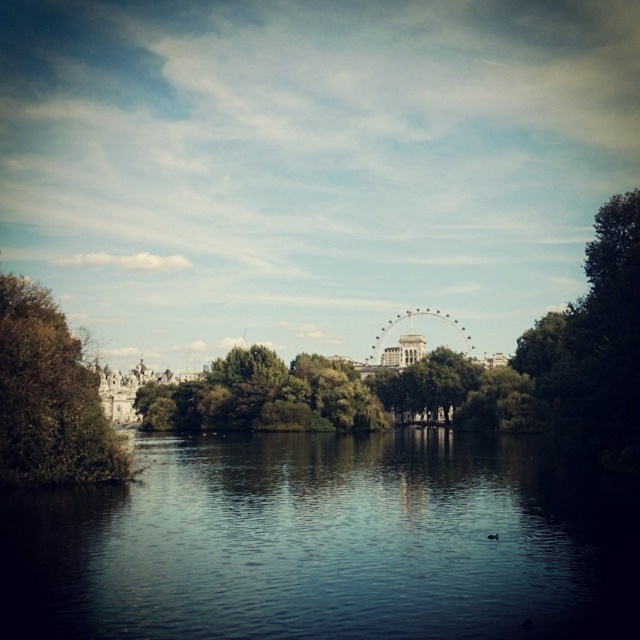
Question: Which point is closer to the camera?

Choices:
 (A) (372, 362)
 (B) (67, 384)
 (C) (353, 404)

Answer: (B)

Question: Which object appears farthest from the camera in this image?

Choices:
 (A) green leafy tree at left
 (B) green leafy tree at right

Answer: (B)

Question: Does green leafy tree at center have a lesser width compared to metallic ferris wheel at center?

Choices:
 (A) yes
 (B) no

Answer: (B)

Question: Does green leafy tree at right have a greater width compared to green leafy tree at left?

Choices:
 (A) no
 (B) yes

Answer: (B)

Question: Can you confirm if dark reflective water at center is positioned to the left of green leafy tree at center?

Choices:
 (A) yes
 (B) no

Answer: (B)

Question: Which point is closer to the camera?

Choices:
 (A) metallic ferris wheel at center
 (B) green leafy tree at right
 (C) dark reflective water at center
 (D) green leafy tree at left

Answer: (C)